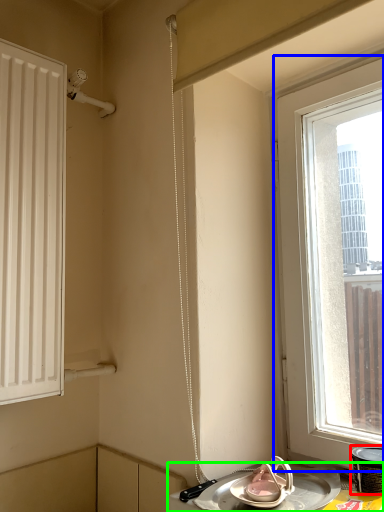
Question: Considering the real-world distances, which object is farthest from appliance (highlighted by a red box)? window (highlighted by a blue box) or table (highlighted by a green box)?

Choices:
 (A) window
 (B) table

Answer: (A)